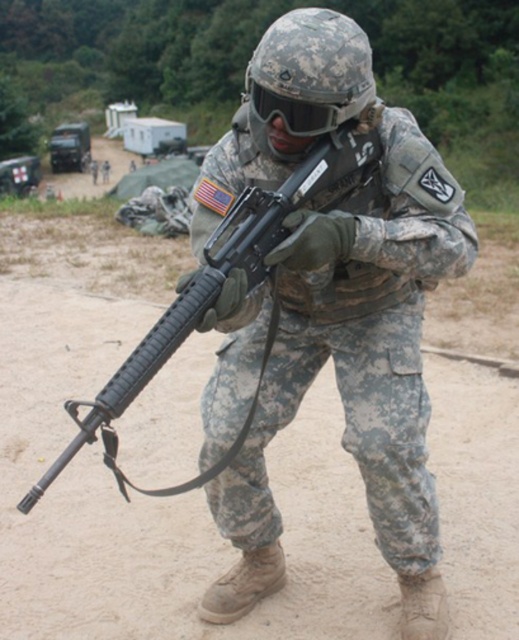
You are a military planner analyzing the terrain. You notice the dirt track at center and the black matte rifle at center. Which object occupies a larger area in the image?

The black matte rifle at center is larger than the dirt track at center, so the black matte rifle at center occupies a larger area in the image.